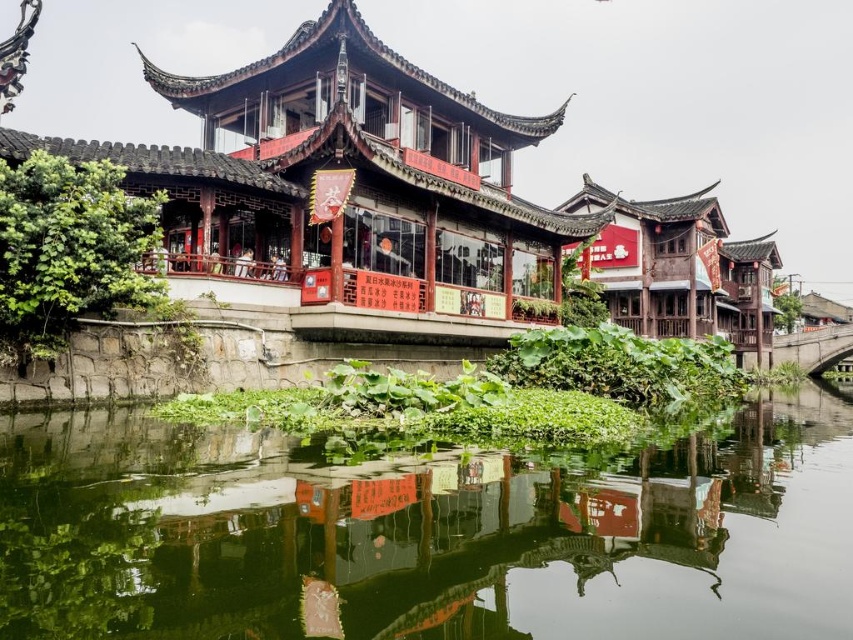
Question: From the image, what is the correct spatial relationship of green reflective water at center in relation to green leafy plant at center-left?

Choices:
 (A) below
 (B) above

Answer: (A)

Question: Can you confirm if green reflective water at center is thinner than green leafy plant at center-left?

Choices:
 (A) no
 (B) yes

Answer: (A)

Question: Which point appears closest to the camera in this image?

Choices:
 (A) (517, 333)
 (B) (115, 291)

Answer: (B)

Question: Which of these objects is positioned closest to the green leafy plant at center?

Choices:
 (A) green leafy plant at center-left
 (B) green reflective water at center

Answer: (B)

Question: Can you confirm if green reflective water at center is positioned to the right of green leafy plant at center-left?

Choices:
 (A) yes
 (B) no

Answer: (A)

Question: Which point appears farthest from the camera in this image?

Choices:
 (A) (660, 628)
 (B) (70, 292)

Answer: (B)